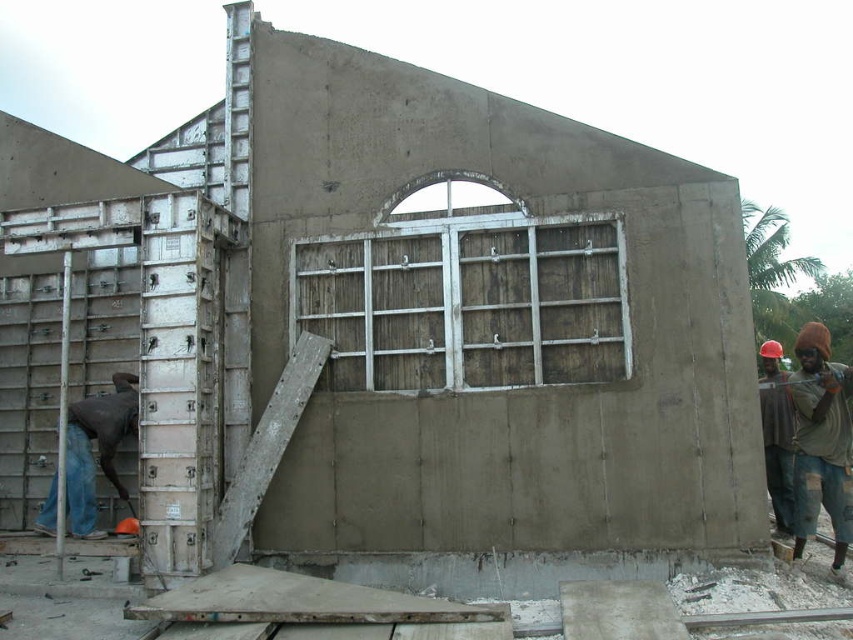
Is weathered wood window at center below brown fabric cap at right?

Incorrect, weathered wood window at center is not positioned below brown fabric cap at right.

Is weathered wood window at center to the right of brown fabric cap at right from the viewer's perspective?

In fact, weathered wood window at center is to the left of brown fabric cap at right.

Who is more forward, (440,376) or (799,358)?

Point (440,376) is in front.

I want to click on weathered wood window at center, so click(x=466, y=305).

Does weathered wood window at center have a greater width compared to dark blue jeans at left?

Yes, weathered wood window at center is wider than dark blue jeans at left.

Which of these two, weathered wood window at center or dark blue jeans at left, stands taller?

dark blue jeans at left

This screenshot has height=640, width=853. What are the coordinates of `weathered wood window at center` in the screenshot? It's located at (466, 305).

Where is `weathered wood window at center`? weathered wood window at center is located at coordinates (466, 305).

Is brown fabric cap at right above dark blue jeans at left?

Indeed, brown fabric cap at right is positioned over dark blue jeans at left.

Is brown fabric cap at right to the right of dark blue jeans at left from the viewer's perspective?

Yes, brown fabric cap at right is to the right of dark blue jeans at left.

What do you see at coordinates (821, 442) in the screenshot? This screenshot has width=853, height=640. I see `brown fabric cap at right` at bounding box center [821, 442].

Locate an element on the screen. This screenshot has height=640, width=853. brown fabric cap at right is located at coordinates (821, 442).